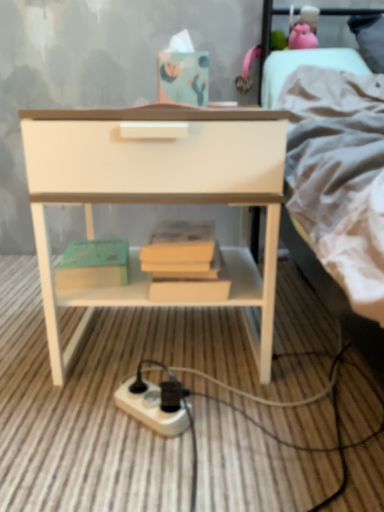
This screenshot has height=512, width=384. In order to click on empty space that is to the right of white plastic power plugs and sockets at lower center in this screenshot , I will do `click(243, 421)`.